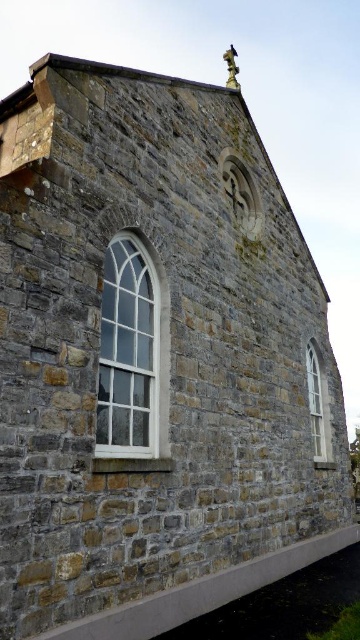
Question: Is clear glass window at center further to the viewer compared to white glass window at lower right?

Choices:
 (A) no
 (B) yes

Answer: (A)

Question: Which of the following is the closest to the observer?

Choices:
 (A) (322, 428)
 (B) (149, 321)

Answer: (B)

Question: Which point is closer to the camera taking this photo?

Choices:
 (A) (153, 388)
 (B) (315, 445)

Answer: (A)

Question: Does clear glass window at center appear under white glass window at lower right?

Choices:
 (A) no
 (B) yes

Answer: (A)

Question: Is clear glass window at center to the left of white glass window at lower right from the viewer's perspective?

Choices:
 (A) yes
 (B) no

Answer: (A)